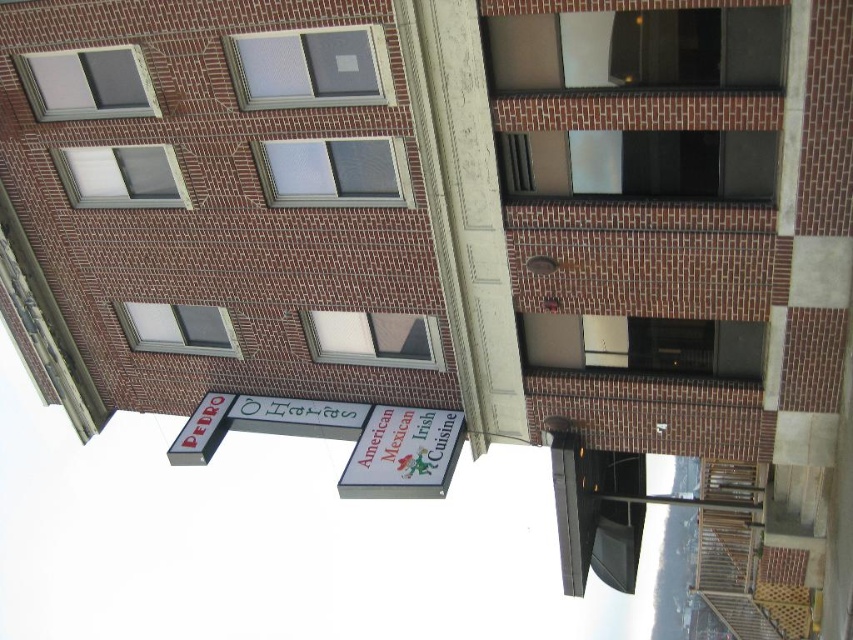
You are standing in front of a building and see the white plastic sign at lower center and the metallic silver sign at left. Which sign is positioned more to the right side of the building?

The white plastic sign at lower center is positioned more to the right side of the building compared to the metallic silver sign at left.

You are a delivery driver approaching the building and need to read both the white plastic sign at lower center and the metallic silver sign at left. Which sign will you notice first based on their sizes?

The white plastic sign at lower center has a greater height compared to the metallic silver sign at left, so you will notice the white plastic sign at lower center first due to its larger size.

You are standing in front of the building and want to read both the white plastic sign at lower center and the metallic silver sign at left. Which sign do you need to look at first to see both without moving your head?

You should look at the white plastic sign at lower center first because it is in front of the metallic silver sign at left, so you can see it without moving your head and then see the metallic silver sign at left behind it.